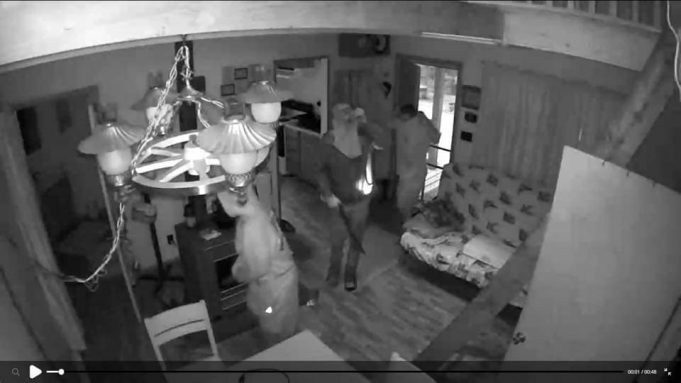
I want to click on drapes, so 526,118.